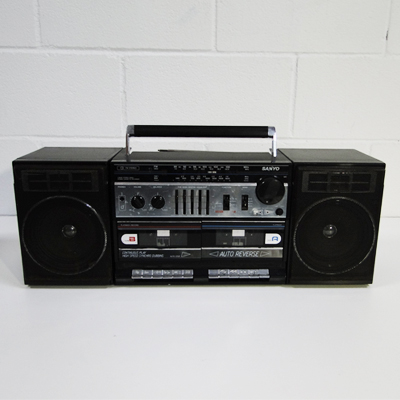
This screenshot has height=400, width=400. I want to click on boombox handle, so click(x=165, y=133).